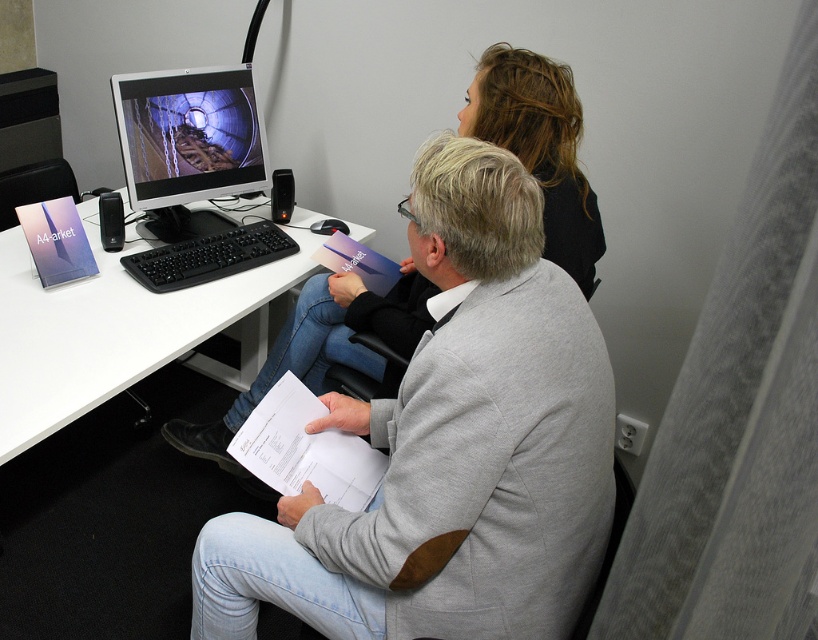
Is white plastic computer desk at lower left taller than black fabric hair at upper center?

No, white plastic computer desk at lower left is not taller than black fabric hair at upper center.

The image size is (818, 640). Find the location of `white plastic computer desk at lower left`. white plastic computer desk at lower left is located at coordinates (119, 328).

Between black fabric hair at upper center and matte black monitor at center, which one has less height?

Standing shorter between the two is matte black monitor at center.

Between point (551, 241) and point (162, 74), which one is positioned in front?

Positioned in front is point (551, 241).

Is point (553, 172) behind point (212, 212)?

That is False.

Image resolution: width=818 pixels, height=640 pixels. In order to click on black fabric hair at upper center in this screenshot , I will do [x=538, y=147].

Between point (0, 280) and point (178, 192), which one is positioned behind?

Point (178, 192)

Find the location of a particular element. This screenshot has height=640, width=818. white plastic computer desk at lower left is located at coordinates (x=119, y=328).